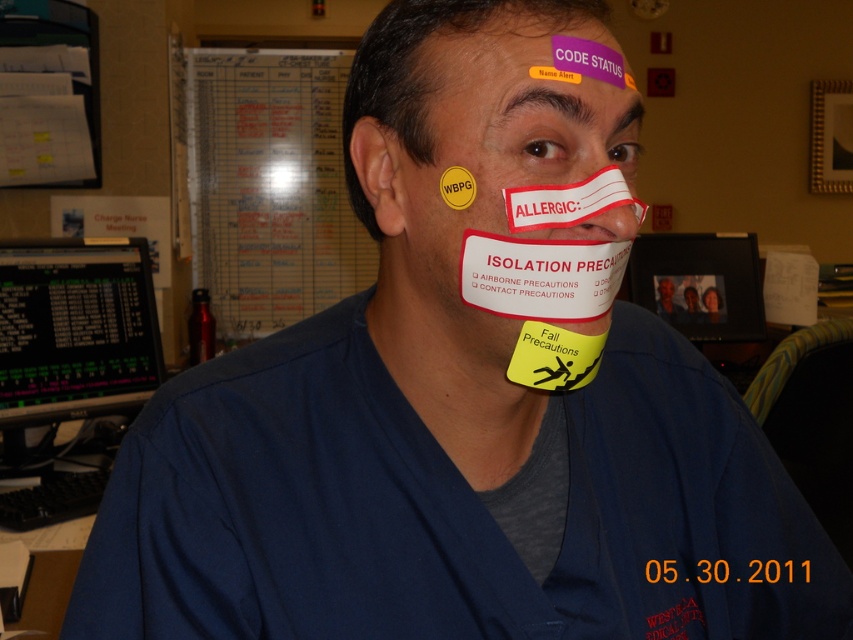
Can you confirm if green lcd monitor at left is thinner than yellow matte sticker at upper center?

Incorrect, green lcd monitor at left's width is not less than yellow matte sticker at upper center's.

Is green lcd monitor at left above yellow matte sticker at upper center?

Actually, green lcd monitor at left is below yellow matte sticker at upper center.

Is point (77, 294) positioned in front of point (364, 44)?

No, it is behind (364, 44).

The width and height of the screenshot is (853, 640). I want to click on green lcd monitor at left, so click(x=74, y=328).

Can you confirm if yellow matte sticker at upper center is positioned to the left of purple sticker at upper center?

Indeed, yellow matte sticker at upper center is positioned on the left side of purple sticker at upper center.

Does yellow matte sticker at upper center appear on the right side of purple sticker at upper center?

In fact, yellow matte sticker at upper center is to the left of purple sticker at upper center.

What do you see at coordinates (427, 68) in the screenshot?
I see `yellow matte sticker at upper center` at bounding box center [427, 68].

Image resolution: width=853 pixels, height=640 pixels. Identify the location of yellow matte sticker at upper center. (427, 68).

Who is more distant from viewer, (x=42, y=339) or (x=618, y=51)?

The point (x=42, y=339) is behind.

Which of these two, green lcd monitor at left or purple sticker at upper center, stands shorter?

Standing shorter between the two is purple sticker at upper center.

Locate an element on the screen. green lcd monitor at left is located at coordinates (74, 328).